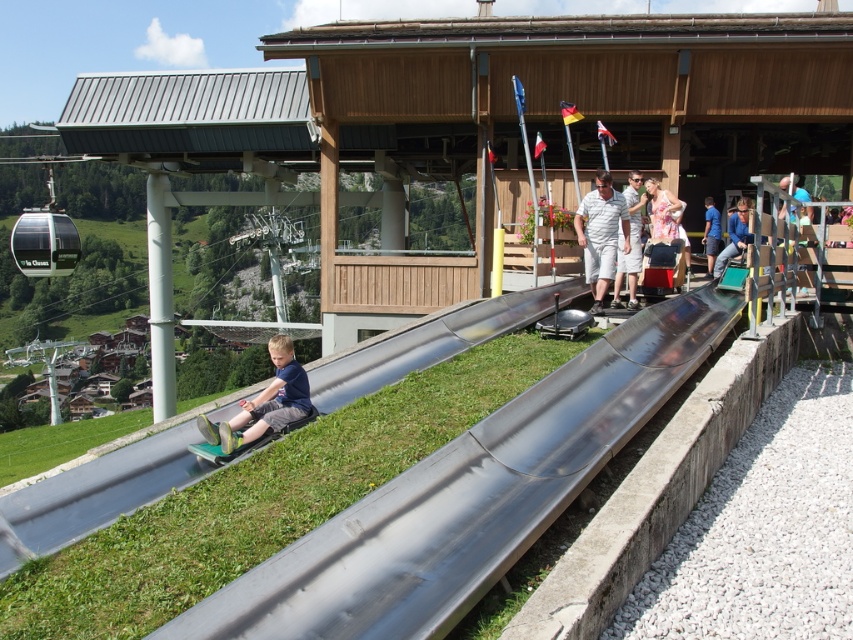
Question: Among these objects, which one is farthest from the camera?

Choices:
 (A) matte blue shorts at lower left
 (B) blue fabric shirt at center

Answer: (B)

Question: Estimate the real-world distances between objects in this image. Which object is closer to the blue fabric shirt at center?

Choices:
 (A) white striped shirt at center
 (B) matte blue shorts at lower left

Answer: (A)

Question: Is white striped shirt at center further to camera compared to blue fabric shirt at center?

Choices:
 (A) no
 (B) yes

Answer: (A)

Question: Does white striped shirt at center have a lesser width compared to blue fabric shirt at center?

Choices:
 (A) yes
 (B) no

Answer: (B)

Question: Among these objects, which one is nearest to the camera?

Choices:
 (A) light blue striped polo shirt at center
 (B) matte blue shorts at lower left
 (C) blue shirt at center
 (D) green grass at lower left

Answer: (D)

Question: Is white striped shirt at center thinner than light blue striped polo shirt at center?

Choices:
 (A) no
 (B) yes

Answer: (B)